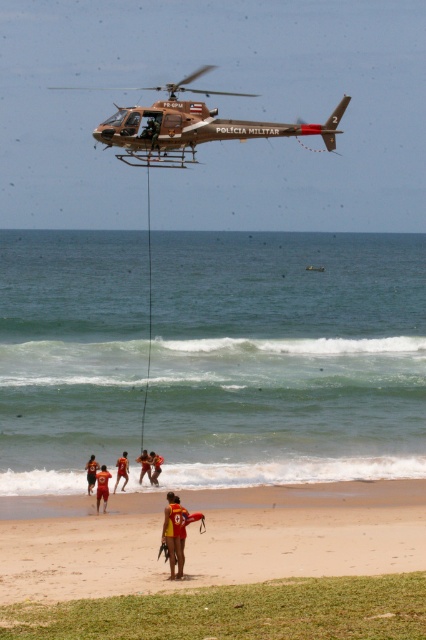
Question: Does green water at lower center appear on the right side of yellow life vest at center?

Choices:
 (A) no
 (B) yes

Answer: (A)

Question: Among these points, which one is farthest from the camera?

Choices:
 (A) (152, 456)
 (B) (103, 502)

Answer: (A)

Question: Is matte brown helicopter at upper center thinner than orange fabric shorts at lower center?

Choices:
 (A) yes
 (B) no

Answer: (B)

Question: Can you confirm if matte brown helicopter at upper center is positioned to the right of red life vest at center?

Choices:
 (A) yes
 (B) no

Answer: (B)

Question: Among these points, which one is farthest from the camera?

Choices:
 (A) (195, 138)
 (B) (167, 536)
 (C) (302, 572)
 (D) (161, 461)

Answer: (D)

Question: Which object is farther from the camera taking this photo?

Choices:
 (A) red life vest at center
 (B) red life vest at lower center
 (C) matte brown helicopter at upper center
 (D) green water at lower center

Answer: (A)